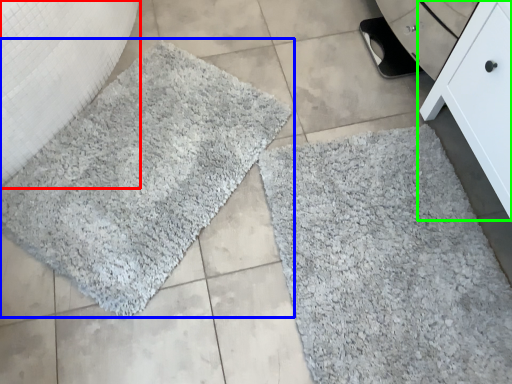
Question: Estimate the real-world distances between objects in this image. Which object is farther from granite (highlighted by a red box), bath mat (highlighted by a blue box) or furniture (highlighted by a green box)?

Choices:
 (A) bath mat
 (B) furniture

Answer: (B)